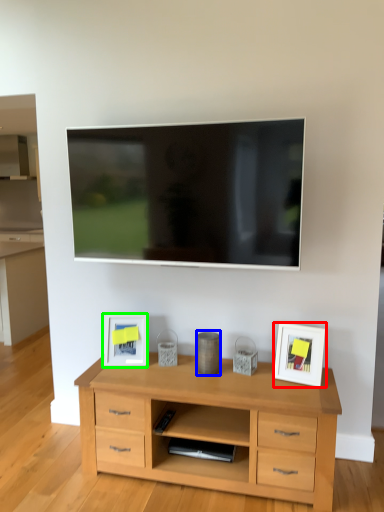
Question: Estimate the real-world distances between objects in this image. Which object is closer to picture frame (highlighted by a red box), appliance (highlighted by a blue box) or picture frame (highlighted by a green box)?

Choices:
 (A) appliance
 (B) picture frame

Answer: (A)